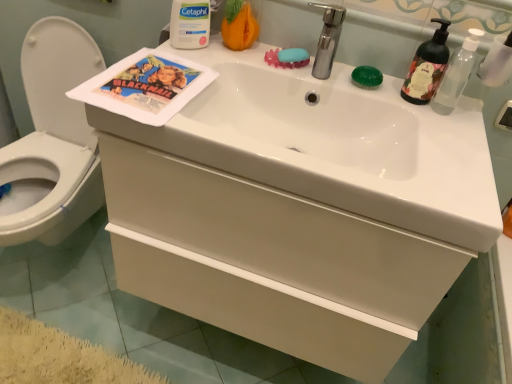
Question: Could white matte drawer at center be considered to be inside white glossy toilet at left?

Choices:
 (A) yes
 (B) no

Answer: (B)

Question: Does white glossy toilet at left have a greater height compared to white matte drawer at center?

Choices:
 (A) no
 (B) yes

Answer: (B)

Question: Is white glossy toilet at left touching white matte drawer at center?

Choices:
 (A) yes
 (B) no

Answer: (B)

Question: From a real-world perspective, is white glossy toilet at left physically below white matte drawer at center?

Choices:
 (A) no
 (B) yes

Answer: (B)

Question: From a real-world perspective, is white glossy toilet at left on top of white matte drawer at center?

Choices:
 (A) yes
 (B) no

Answer: (B)

Question: Considering the positions of silver metallic faucet at upper center and white glossy toilet at left in the image, is silver metallic faucet at upper center taller or shorter than white glossy toilet at left?

Choices:
 (A) tall
 (B) short

Answer: (B)

Question: Looking at their shapes, would you say silver metallic faucet at upper center is wider or thinner than white glossy toilet at left?

Choices:
 (A) thin
 (B) wide

Answer: (A)

Question: Visually, is silver metallic faucet at upper center positioned to the left or to the right of white glossy toilet at left?

Choices:
 (A) right
 (B) left

Answer: (A)

Question: Considering the positions of point (331, 44) and point (56, 105), is point (331, 44) closer or farther from the camera than point (56, 105)?

Choices:
 (A) closer
 (B) farther

Answer: (A)

Question: Considering their positions, is green matte soap dispenser at upper right located in front of or behind white matte drawer at center?

Choices:
 (A) front
 (B) behind

Answer: (B)

Question: Is green matte soap dispenser at upper right to the left or to the right of white matte drawer at center in the image?

Choices:
 (A) right
 (B) left

Answer: (A)

Question: Is point (445, 28) positioned closer to the camera than point (122, 208)?

Choices:
 (A) farther
 (B) closer

Answer: (B)

Question: From a real-world perspective, relative to white matte drawer at center, is green matte soap dispenser at upper right vertically above or below?

Choices:
 (A) below
 (B) above

Answer: (B)

Question: In terms of size, does translucent plastic pump bottle at upper right appear bigger or smaller than white matte cetaphil container at upper center?

Choices:
 (A) small
 (B) big

Answer: (A)

Question: Considering their positions, is translucent plastic pump bottle at upper right located in front of or behind white matte cetaphil container at upper center?

Choices:
 (A) front
 (B) behind

Answer: (A)